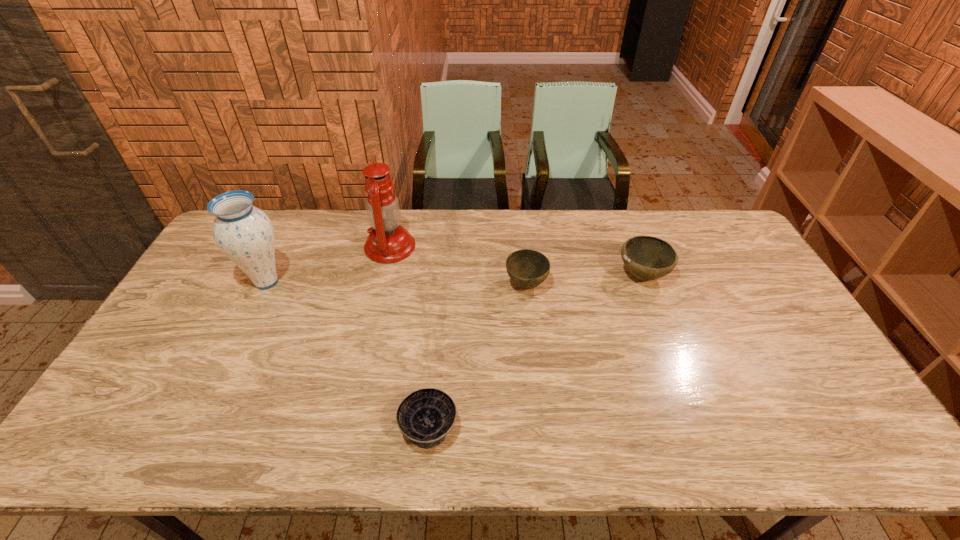
Where is `oil lamp`? The image size is (960, 540). oil lamp is located at coordinates (388, 242).

Identify the location of vase. The image size is (960, 540). (244, 233).

You are a GUI agent. You are given a task and a screenshot of the screen. Output one action in this format:
    pyautogui.click(x=<x>, y=<y>)
    Task: Click on the fourth shortest object
    
    Given the screenshot: What is the action you would take?
    pyautogui.click(x=244, y=233)

Find the location of `the rightmost object`. the rightmost object is located at coordinates (647, 258).

Locate an element on the screen. the second object from right to left is located at coordinates (527, 268).

Locate an element on the screen. The width and height of the screenshot is (960, 540). the nearest object is located at coordinates (426, 416).

What are the coordinates of `the shortest object` in the screenshot? It's located at (426, 416).

Find the location of a particular element. Image resolution: width=960 pixels, height=540 pixels. blank space located on the left of the oil lamp is located at coordinates (324, 247).

Find the location of `vacant space located on the back of the vase`. vacant space located on the back of the vase is located at coordinates (285, 244).

Find the location of a particular element. The width and height of the screenshot is (960, 540). free space located on the left of the rightmost object is located at coordinates (x=583, y=275).